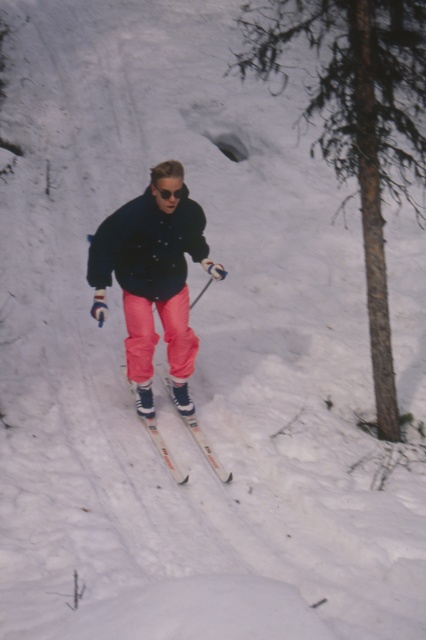
You are a photographer capturing the skier from above. You notice two points marked on your screen at coordinates point (178, 211) and point (176, 193). Which point is closer to the camera?

Point (176, 193) is closer to the camera because it is less further than point (178, 211).

You are a photographer capturing the skier from above. You notice the matte black jacket at center and sunglasses at center. Which object is positioned higher on the skier?

The matte black jacket at center is taller than sunglasses at center, so the matte black jacket at center is positioned higher on the skier.